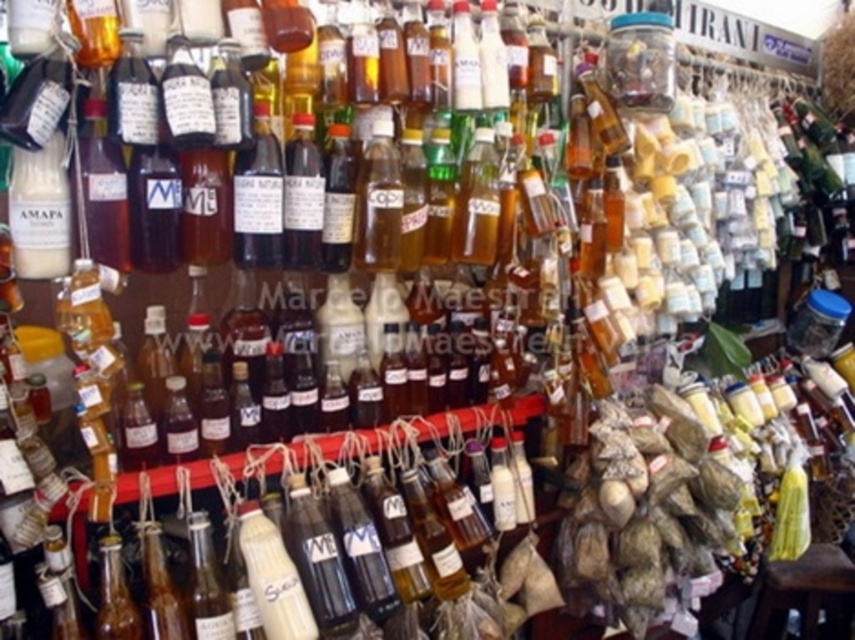
You are a customer trying to place the brown wooden stool at lower right under the brown paper bag at center to catch any items that might fall. Based on their sizes, will the stool fit under the bag?

The brown paper bag at center is taller than the brown wooden stool at lower right, so the stool will fit underneath as it is shorter than the bag.

You are a customer holding a brown paper bag at center and a brown wooden stool at lower right. You want to place the stool on the floor near the bag. Is the stool currently positioned below the bag?

The brown paper bag at center is located above the brown wooden stool at lower right, so yes, the stool is already positioned below the bag. You can place it there.